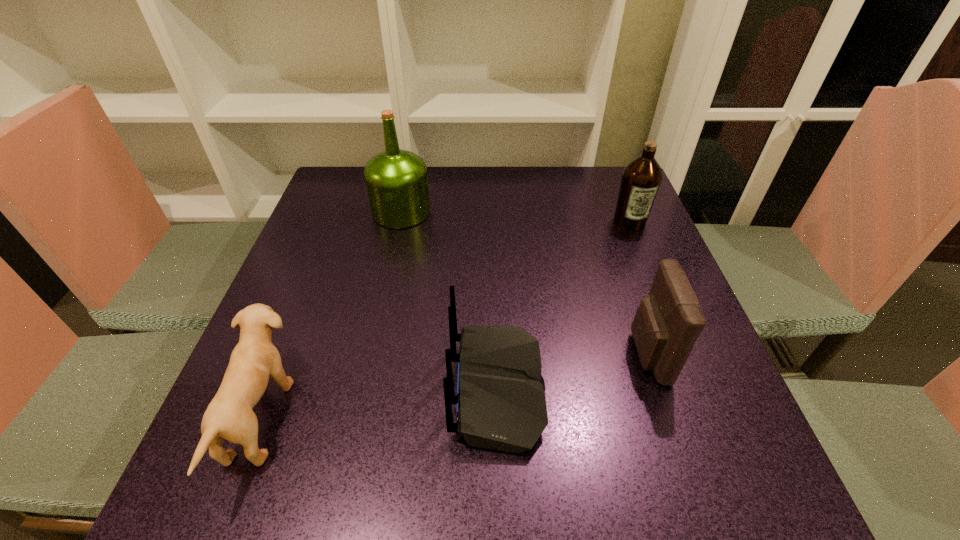
Where is `vacant region located 0.180m with an open flap on the pouch`? vacant region located 0.180m with an open flap on the pouch is located at coordinates coord(536,354).

The image size is (960, 540). I want to click on vacant space located with an open flap on the pouch, so click(x=572, y=354).

You are a GUI agent. You are given a task and a screenshot of the screen. Output one action in this format:
    pyautogui.click(x=<x>, y=<y>)
    Task: Click on the vacant space situated 0.300m on the back of the third object from right to left
    This screenshot has height=540, width=960.
    Given the screenshot: What is the action you would take?
    pyautogui.click(x=279, y=389)

This screenshot has height=540, width=960. I want to click on vacant point located 0.320m on the back of the third object from right to left, so click(268, 389).

Find the location of `free space located on the back of the third object from right to left`. free space located on the back of the third object from right to left is located at coordinates (331, 389).

I want to click on vacant region located on the left side of the leftmost object, so click(466, 418).

You are a GUI agent. You are given a task and a screenshot of the screen. Output one action in this format:
    pyautogui.click(x=<x>, y=<y>)
    Task: Click on the router that is positioned at the near edge
    The image size is (960, 540).
    Given the screenshot: What is the action you would take?
    pyautogui.click(x=501, y=405)

The height and width of the screenshot is (540, 960). I want to click on puppy situated at the near edge, so click(x=229, y=415).

Identify the location of olive oil at the left edge. (396, 180).

Where is `puppy that is at the left edge`? puppy that is at the left edge is located at coordinates (229, 415).